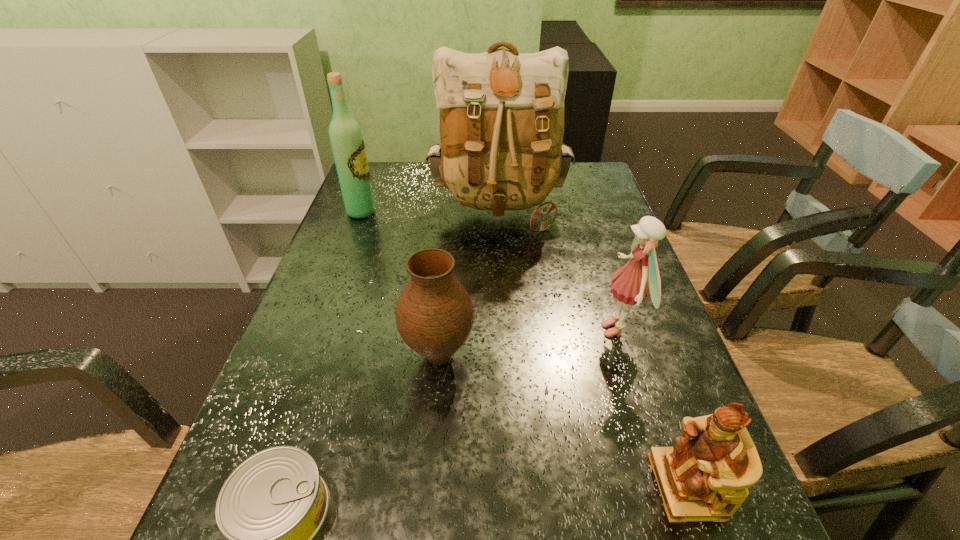
You are a GUI agent. You are given a task and a screenshot of the screen. Output one action in this format:
    pyautogui.click(x=<x>, y=<y>)
    Task: Click on the vacant space at the far edge
    The height and width of the screenshot is (540, 960).
    Given the screenshot: What is the action you would take?
    pyautogui.click(x=428, y=170)

This screenshot has height=540, width=960. Identify the location of free space at the left edge. (353, 293).

In order to click on vacant region at the right edge of the desktop in this screenshot , I will do `click(612, 357)`.

The width and height of the screenshot is (960, 540). I want to click on free space at the far left corner, so (374, 168).

You are a GUI agent. You are given a task and a screenshot of the screen. Output one action in this format:
    pyautogui.click(x=<x>, y=<y>)
    Task: Click on the free location at the far right corner of the desktop
    The width and height of the screenshot is (960, 540).
    Given the screenshot: What is the action you would take?
    pyautogui.click(x=588, y=195)

I want to click on free point between the wine bottle and the doll, so click(490, 271).

This screenshot has height=540, width=960. I want to click on free space that is in between the backpack and the wine bottle, so click(430, 212).

Locate an element on the screen. vacant space that is in between the second tallest object and the doll is located at coordinates (490, 271).

Image resolution: width=960 pixels, height=540 pixels. In order to click on free area in between the backpack and the fifth shortest object in this screenshot , I will do `click(430, 212)`.

Image resolution: width=960 pixels, height=540 pixels. I want to click on free space between the backpack and the figurine, so [x=592, y=349].